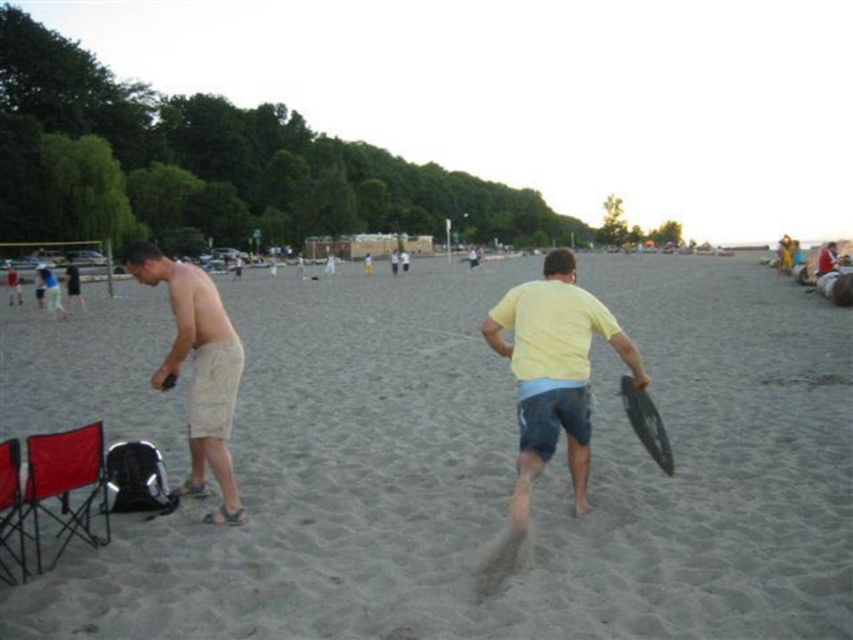
You are a photographer standing at the edge of the beach. You want to take a photo of the gray sand at center and the yellow matte shirt at center. Which object should you focus on first if you want the one closer to you to be sharp?

The gray sand at center is in front of the yellow matte shirt at center, so you should focus on the gray sand at center first to ensure it is sharp.

You are a photographer standing on the beach and want to capture a wide shot of the gray sand at center and the yellow matte shirt at center. Which object in the scene is wider when viewed from your position?

The gray sand at center is wider than the yellow matte shirt at center.